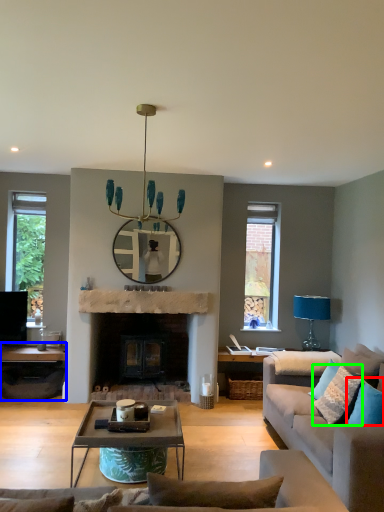
Question: Based on their relative distances, which object is farther from pillow (highlighted by a red box)? Choose from table (highlighted by a blue box) and pillow (highlighted by a green box).

Choices:
 (A) table
 (B) pillow

Answer: (A)